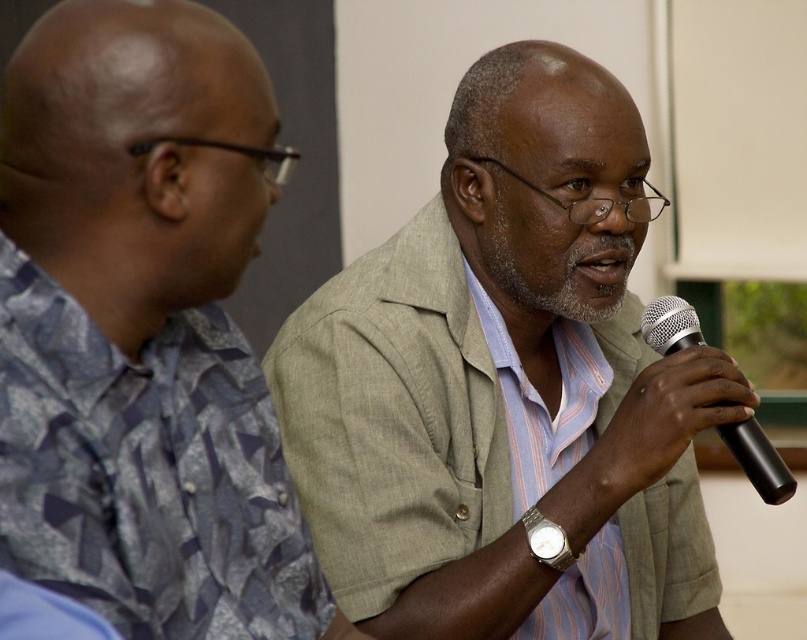
Question: Does light gray fabric shirt at center have a larger size compared to black matte microphone at right?

Choices:
 (A) no
 (B) yes

Answer: (B)

Question: Among these points, which one is nearest to the camera?

Choices:
 (A) (736, 445)
 (B) (126, 305)
 (C) (655, 488)

Answer: (B)

Question: Which of the following is the closest to the observer?

Choices:
 (A) (208, 483)
 (B) (746, 438)
 (C) (460, 132)

Answer: (A)

Question: Which object is positioned farthest from the light gray fabric shirt at center?

Choices:
 (A) gray fabric shirt at upper right
 (B) black matte microphone at right

Answer: (A)

Question: Can you confirm if light gray fabric shirt at center is wider than gray fabric shirt at upper right?

Choices:
 (A) no
 (B) yes

Answer: (B)

Question: Observing the image, what is the correct spatial positioning of light gray fabric shirt at center in reference to gray fabric shirt at upper right?

Choices:
 (A) left
 (B) right

Answer: (B)